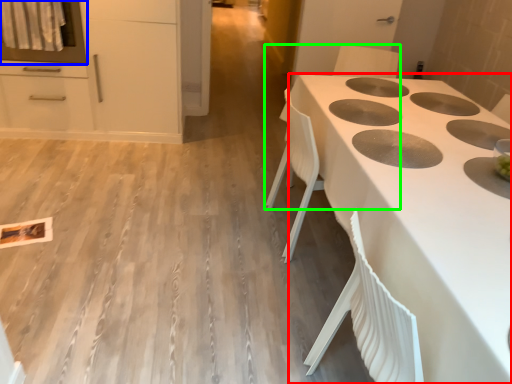
Question: Estimate the real-world distances between objects in this image. Which object is farther from countertop (highlighted by a red box), oven (highlighted by a blue box) or chair (highlighted by a green box)?

Choices:
 (A) oven
 (B) chair

Answer: (A)